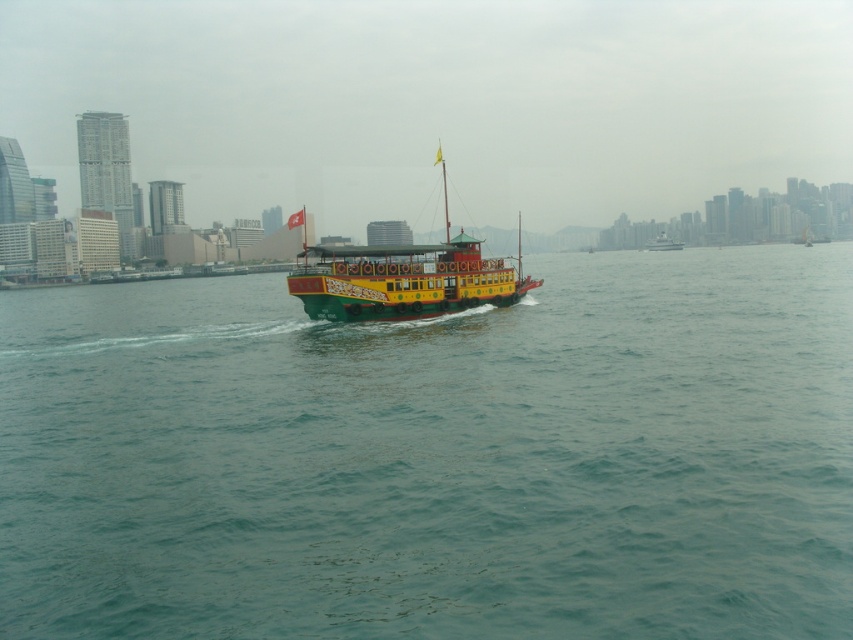
Question: Can you confirm if green water at center is positioned above yellow-green painted ferry at center?

Choices:
 (A) no
 (B) yes

Answer: (A)

Question: Estimate the real-world distances between objects in this image. Which object is farther from the yellow-green painted wooden boat at center?

Choices:
 (A) green water at center
 (B) yellow-green painted ferry at center

Answer: (B)

Question: Which point is farther to the camera?

Choices:
 (A) green water at center
 (B) yellow-green painted wooden boat at center

Answer: (B)

Question: Is green water at center positioned before yellow-green painted wooden boat at center?

Choices:
 (A) yes
 (B) no

Answer: (A)

Question: Which of the following is the farthest from the observer?

Choices:
 (A) yellow-green painted ferry at center
 (B) yellow-green painted wooden boat at center

Answer: (A)

Question: Is yellow-green painted wooden boat at center further to the viewer compared to yellow-green painted ferry at center?

Choices:
 (A) no
 (B) yes

Answer: (A)